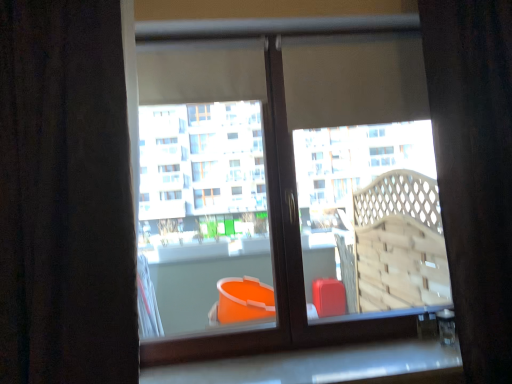
Question: From a real-world perspective, is white marble window sill at lower center above or below velvet dark brown curtain at right, which is counted as the first curtain, starting from the right?

Choices:
 (A) above
 (B) below

Answer: (B)

Question: In terms of width, does white marble window sill at lower center look wider or thinner when compared to velvet dark brown curtain at right, which is counted as the first curtain, starting from the right?

Choices:
 (A) thin
 (B) wide

Answer: (A)

Question: Which object is positioned farthest from the white marble window sill at lower center?

Choices:
 (A) matte plastic bucket at center
 (B) brown textured curtain at left, arranged as the 2th curtain when viewed from the right
 (C) velvet dark brown curtain at right, arranged as the second curtain when viewed from the left

Answer: (B)

Question: Estimate the real-world distances between objects in this image. Which object is closer to the velvet dark brown curtain at right, arranged as the second curtain when viewed from the left?

Choices:
 (A) brown textured curtain at left, arranged as the 2th curtain when viewed from the right
 (B) white marble window sill at lower center
 (C) matte plastic bucket at center

Answer: (B)